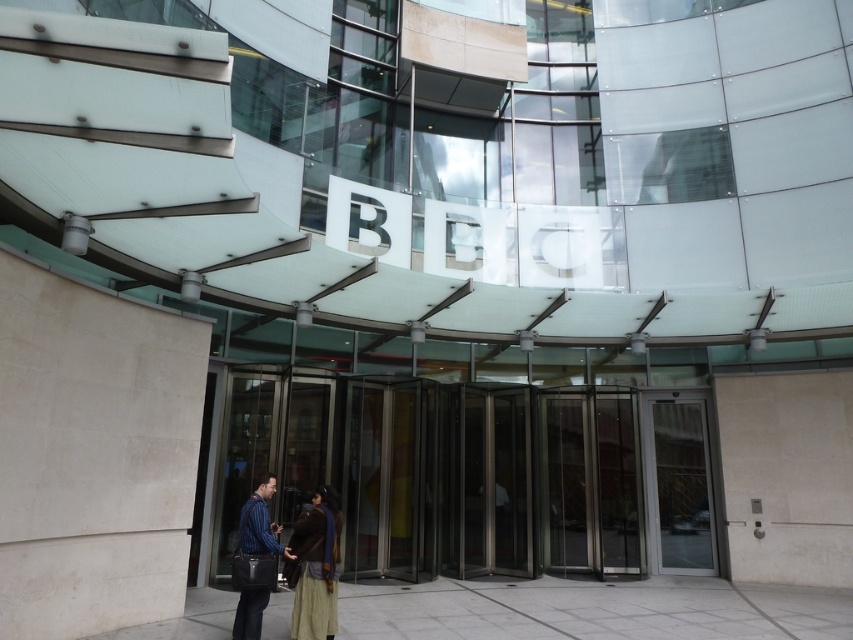
Question: Which point is closer to the camera?

Choices:
 (A) (253, 548)
 (B) (329, 582)
 (C) (677, 412)

Answer: (A)

Question: Does transparent glass door at center lie in front of striped fabric shirt at center?

Choices:
 (A) yes
 (B) no

Answer: (B)

Question: Which of these objects is positioned farthest from the brown textured coat at center?

Choices:
 (A) striped fabric shirt at center
 (B) transparent glass door at center

Answer: (B)

Question: Is transparent glass door at center to the right of brown textured coat at center from the viewer's perspective?

Choices:
 (A) yes
 (B) no

Answer: (A)

Question: Based on their relative distances, which object is farther from the striped fabric shirt at center?

Choices:
 (A) transparent glass door at center
 (B) brown textured coat at center

Answer: (A)

Question: In this image, where is transparent glass door at center located relative to striped fabric shirt at center?

Choices:
 (A) right
 (B) left

Answer: (A)